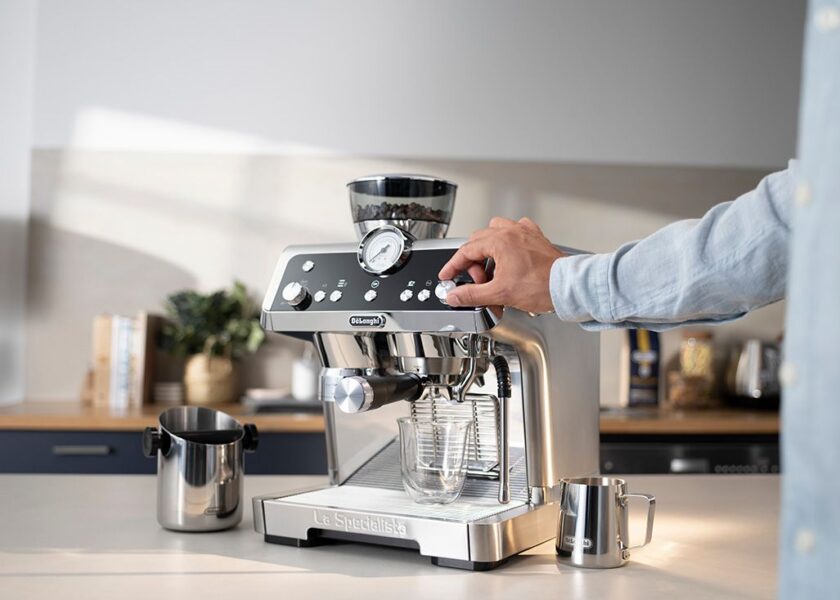
Locate an element on the screen. The width and height of the screenshot is (840, 600). countertop is located at coordinates (88, 543), (720, 546).